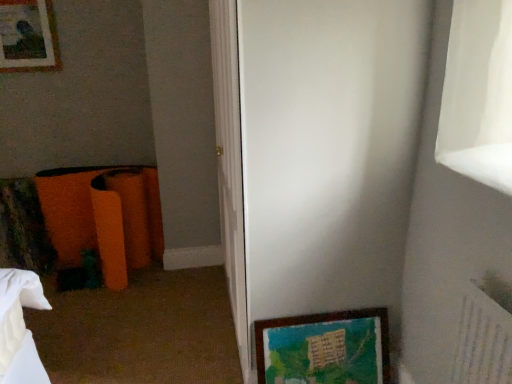
Question: Does white glossy screen door at center appear on the right side of wooden framed artwork at lower right, which appears as the 2th picture frame when viewed from the top?

Choices:
 (A) yes
 (B) no

Answer: (B)

Question: Is white glossy screen door at center not near wooden framed artwork at lower right, positioned as the first picture frame in front-to-back order?

Choices:
 (A) no
 (B) yes

Answer: (A)

Question: Is wooden framed artwork at lower right, which appears as the first picture frame when ordered from the bottom, surrounded by white glossy screen door at center?

Choices:
 (A) no
 (B) yes

Answer: (B)

Question: Considering the relative sizes of white glossy screen door at center and wooden framed artwork at lower right, which appears as the first picture frame when ordered from the bottom, in the image provided, is white glossy screen door at center smaller than wooden framed artwork at lower right, which appears as the first picture frame when ordered from the bottom,?

Choices:
 (A) yes
 (B) no

Answer: (B)

Question: Does white glossy screen door at center have a greater height compared to wooden framed artwork at lower right, the 2th picture frame positioned from the back?

Choices:
 (A) no
 (B) yes

Answer: (B)

Question: Is wooden framed artwork at lower right, which appears as the first picture frame when ordered from the bottom, wider or thinner than matte wooden picture frame at upper left, the first picture frame viewed from the back?

Choices:
 (A) wide
 (B) thin

Answer: (A)

Question: From a real-world perspective, is wooden framed artwork at lower right, the 2th picture frame positioned from the back, physically located above or below matte wooden picture frame at upper left, the second picture frame when ordered from right to left?

Choices:
 (A) above
 (B) below

Answer: (B)

Question: Do you think wooden framed artwork at lower right, which appears as the second picture frame when viewed from the left, is within matte wooden picture frame at upper left, which appears as the 1th picture frame when viewed from the top, or outside of it?

Choices:
 (A) outside
 (B) inside

Answer: (A)

Question: Does point (342, 377) appear closer or farther from the camera than point (24, 57)?

Choices:
 (A) closer
 (B) farther

Answer: (A)

Question: In the image, is matte wooden picture frame at upper left, the second picture frame when ordered from right to left, positioned in front of or behind wooden framed artwork at lower right, which appears as the 2th picture frame when viewed from the top?

Choices:
 (A) behind
 (B) front

Answer: (A)

Question: Is point (42, 44) closer or farther from the camera than point (334, 324)?

Choices:
 (A) farther
 (B) closer

Answer: (A)

Question: Visually, is matte wooden picture frame at upper left, the second picture frame positioned from the front, positioned to the left or to the right of wooden framed artwork at lower right, positioned as the first picture frame in front-to-back order?

Choices:
 (A) left
 (B) right

Answer: (A)

Question: Considering the positions of matte wooden picture frame at upper left, which ranks as the first picture frame in left-to-right order, and wooden framed artwork at lower right, positioned as the first picture frame in front-to-back order, in the image, is matte wooden picture frame at upper left, which ranks as the first picture frame in left-to-right order, wider or thinner than wooden framed artwork at lower right, positioned as the first picture frame in front-to-back order,?

Choices:
 (A) thin
 (B) wide

Answer: (A)

Question: Considering the positions of matte wooden picture frame at upper left, the second picture frame when ordered from right to left, and white glossy screen door at center in the image, is matte wooden picture frame at upper left, the second picture frame when ordered from right to left, taller or shorter than white glossy screen door at center?

Choices:
 (A) tall
 (B) short

Answer: (B)

Question: Considering the positions of matte wooden picture frame at upper left, the second picture frame when ordered from right to left, and white glossy screen door at center in the image, is matte wooden picture frame at upper left, the second picture frame when ordered from right to left, bigger or smaller than white glossy screen door at center?

Choices:
 (A) big
 (B) small

Answer: (B)